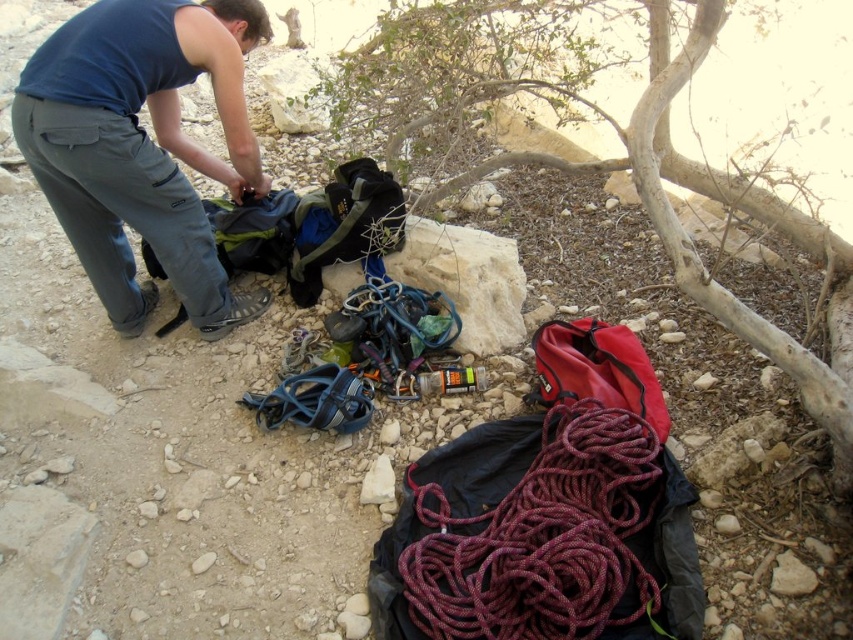
Question: Which object appears farthest from the camera in this image?

Choices:
 (A) blue fabric pants at left
 (B) maroon braided rope at center

Answer: (A)

Question: Which of the following is the farthest from the observer?

Choices:
 (A) blue fabric pants at left
 (B) maroon braided rope at center

Answer: (A)

Question: Is blue fabric pants at left thinner than maroon braided rope at center?

Choices:
 (A) no
 (B) yes

Answer: (A)

Question: Does blue fabric pants at left appear under maroon braided rope at center?

Choices:
 (A) no
 (B) yes

Answer: (A)

Question: Can you confirm if blue fabric pants at left is wider than maroon braided rope at center?

Choices:
 (A) yes
 (B) no

Answer: (A)